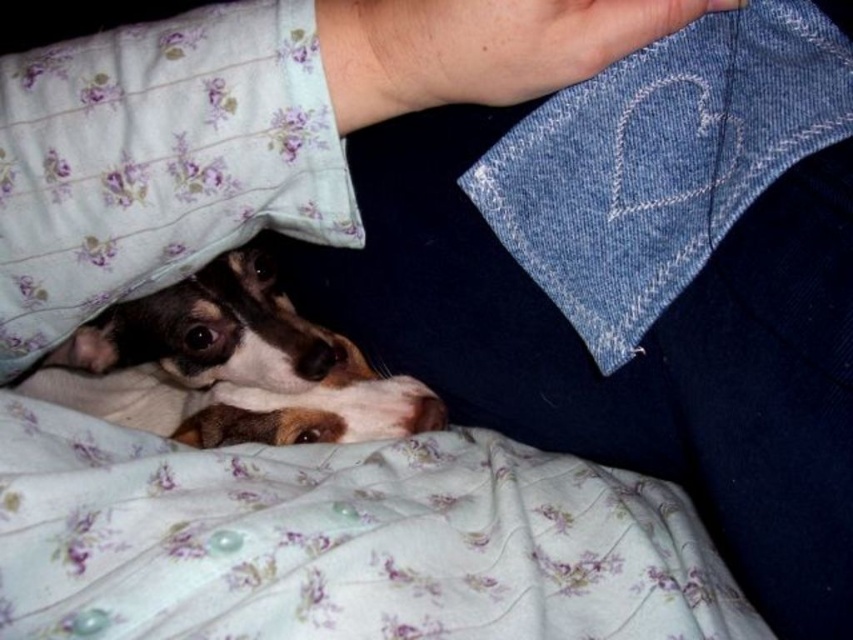
You are a photographer trying to capture the dog under the blanket. The dog is at the center of the image. You need to position a light source at point (x=341, y=540) to highlight the fluffy white blanket at lower left. Will placing the light there effectively illuminate the blanket?

Yes, placing the light source at point (x=341, y=540) will effectively illuminate the fluffy white blanket at lower left since that point indicates its location.

In the scene shown: You are a photographer trying to capture a closeup shot of the brown and white fur at center. You are currently positioned 12 inches away from the denim at upper center. Can you get the shot without moving closer than your current position?

The denim at upper center and brown and white fur at center are 11.77 inches apart from each other. Since you are currently 12 inches away from the denim at upper center, you can capture the closeup shot of the brown and white fur at center without moving closer because the distance between them is slightly less than your current position.